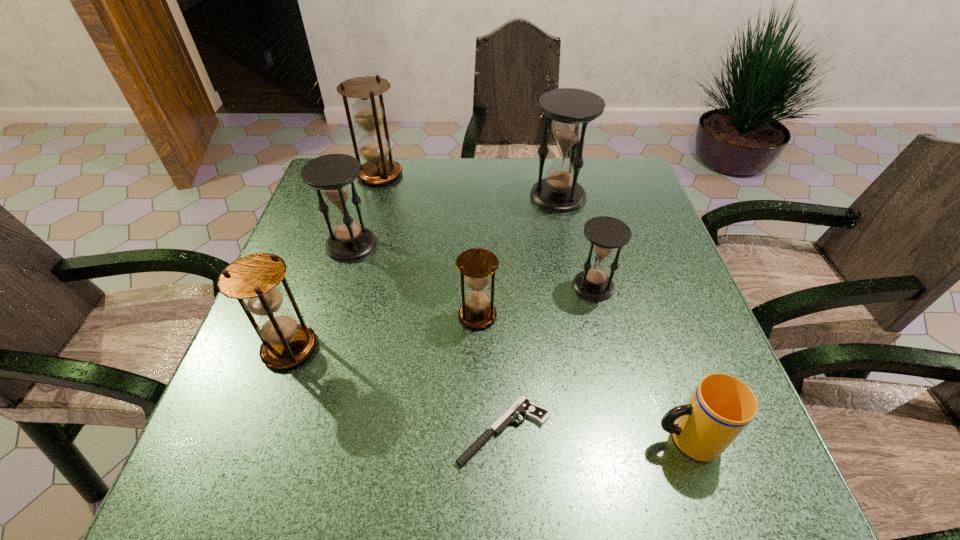
In order to click on vacant space at the far edge in this screenshot , I will do `click(455, 199)`.

Image resolution: width=960 pixels, height=540 pixels. I want to click on vacant region at the near edge of the desktop, so click(444, 453).

Find the location of a particular element. The width and height of the screenshot is (960, 540). free space at the left edge is located at coordinates click(329, 217).

Locate an element on the screen. free spot at the right edge of the desktop is located at coordinates (642, 306).

Where is `free spot at the far right corner of the desktop`? Image resolution: width=960 pixels, height=540 pixels. free spot at the far right corner of the desktop is located at coordinates (612, 179).

At what (x,y) coordinates should I click in order to perform the action: click on unoccupied position between the biggest black hourglass and the smallest black hourglass. Please return your answer as a coordinate pair (x, y). The width and height of the screenshot is (960, 540). Looking at the image, I should click on (576, 241).

The width and height of the screenshot is (960, 540). Find the location of `vacant region between the biggest black hourglass and the smallest brown hourglass`. vacant region between the biggest black hourglass and the smallest brown hourglass is located at coordinates (517, 256).

This screenshot has height=540, width=960. In order to click on vacant area that lies between the second smallest brown hourglass and the third hourglass from right to left in this screenshot , I will do `click(384, 332)`.

Image resolution: width=960 pixels, height=540 pixels. I want to click on free spot between the second smallest brown hourglass and the farthest black hourglass, so click(424, 272).

Find the location of a particular element. The image size is (960, 540). vacant space that is in between the second biggest brown hourglass and the smallest brown hourglass is located at coordinates (384, 332).